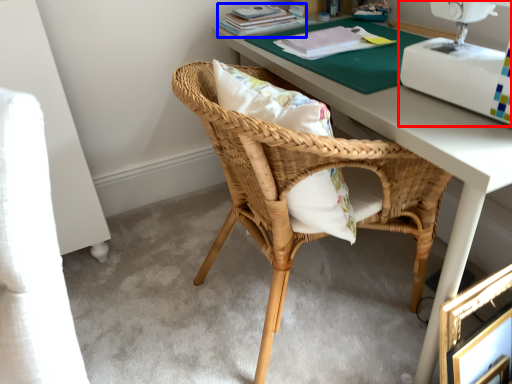
Question: Which point is further to the camera, sewing machine (highlighted by a red box) or book (highlighted by a blue box)?

Choices:
 (A) sewing machine
 (B) book

Answer: (B)